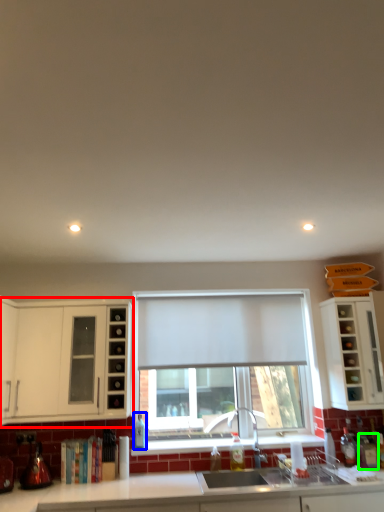
Question: Based on their relative distances, which object is farther from cabinetry (highlighted by a red box)? Choose from bottle (highlighted by a blue box) and bottle (highlighted by a green box).

Choices:
 (A) bottle
 (B) bottle

Answer: (B)